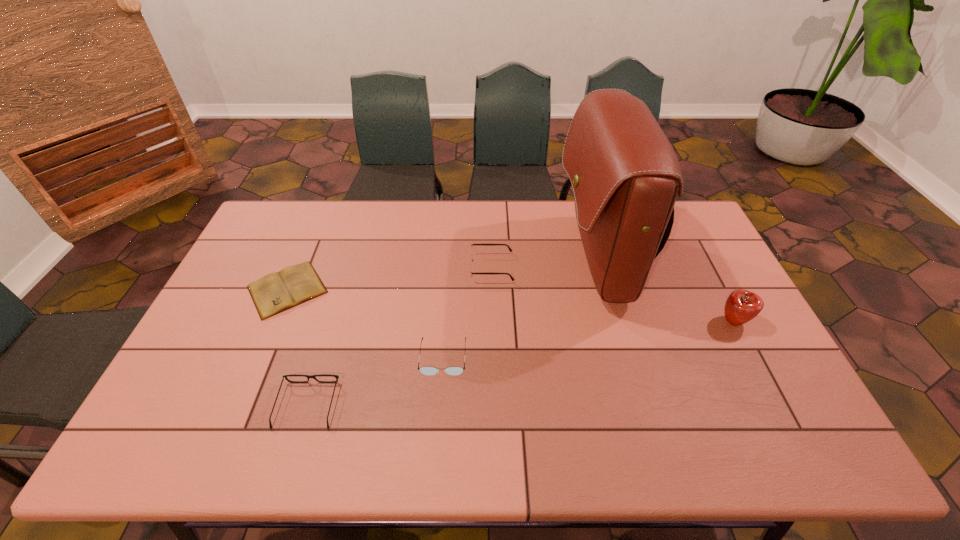
At what (x,y) coordinates should I click in order to perform the action: click on free region located on the front-facing side of the leftmost spectacles. Please return your answer as a coordinate pair (x, y). This screenshot has width=960, height=540. Looking at the image, I should click on (327, 339).

At what (x,y) coordinates should I click in order to perform the action: click on free space located 0.320m on the front-facing side of the leftmost spectacles. Please return your answer as a coordinate pair (x, y). Looking at the image, I should click on (342, 292).

This screenshot has height=540, width=960. I want to click on vacant space located 0.240m on the front of the shortest object, so click(243, 394).

This screenshot has height=540, width=960. What are the coordinates of `object present at the far edge` in the screenshot? It's located at (625, 175).

The image size is (960, 540). Identify the location of object present at the near edge. (284, 376).

Identify the location of object situated at the left edge. This screenshot has height=540, width=960. (293, 285).

The image size is (960, 540). In order to click on object present at the right edge in this screenshot , I will do pos(741,306).

I want to click on free space at the far edge of the desktop, so click(x=346, y=222).

This screenshot has height=540, width=960. What are the coordinates of `free space at the near edge of the desktop` in the screenshot? It's located at tap(424, 434).

In the image, there is a desktop. Identify the location of vacant region at the left edge. (255, 246).